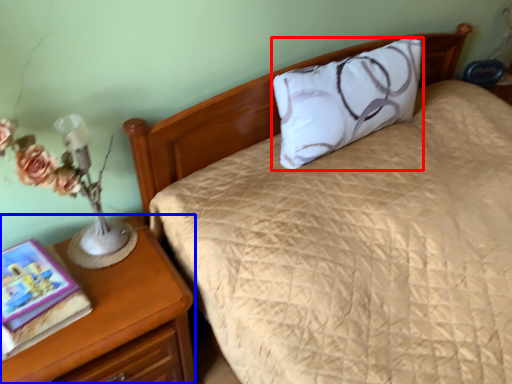
Question: Among these objects, which one is farthest to the camera, pillow (highlighted by a red box) or nightstand (highlighted by a blue box)?

Choices:
 (A) pillow
 (B) nightstand

Answer: (A)